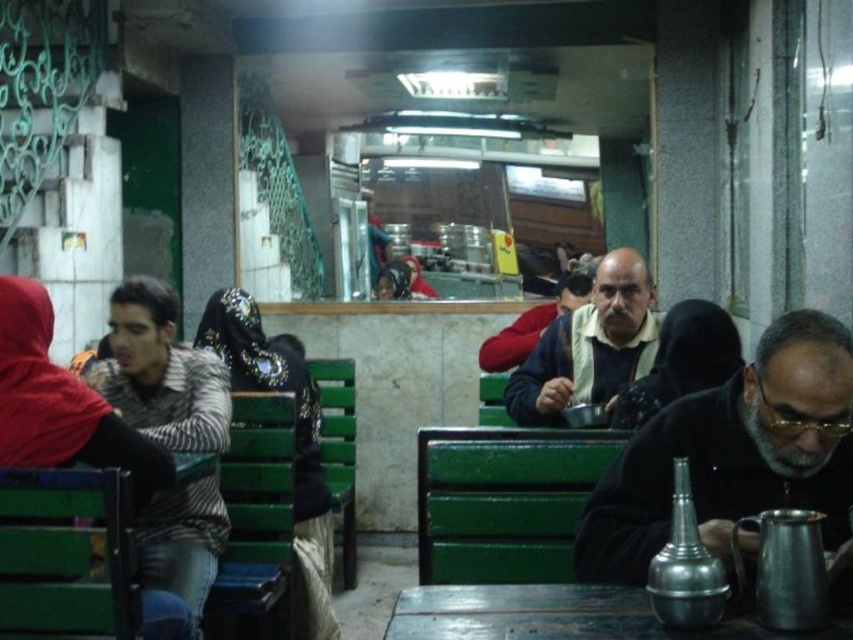
You are a customer at the cafe and want to place your dark blue sweater at center on the metallic wooden table at center. Will the sweater fit entirely on the table?

The metallic wooden table at center is wider than the dark blue sweater at center, so the sweater will fit entirely on the table.